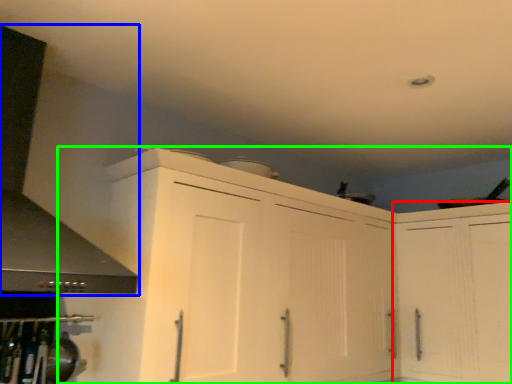
Question: Which object is the farthest from cabinetry (highlighted by a red box)? Choose among these: exhaust hood (highlighted by a blue box) or cabinetry (highlighted by a green box).

Choices:
 (A) exhaust hood
 (B) cabinetry

Answer: (A)